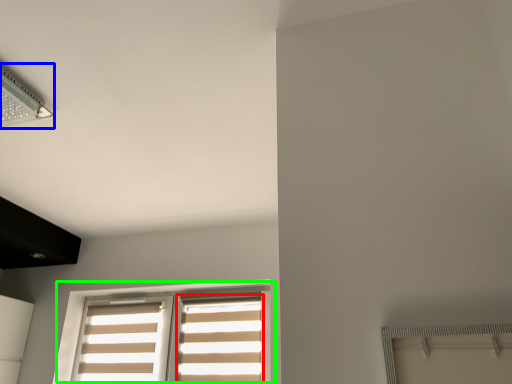
Question: Considering the real-world distances, which object is closest to curtain (highlighted by a red box)? lamp (highlighted by a blue box) or window (highlighted by a green box).

Choices:
 (A) lamp
 (B) window

Answer: (B)